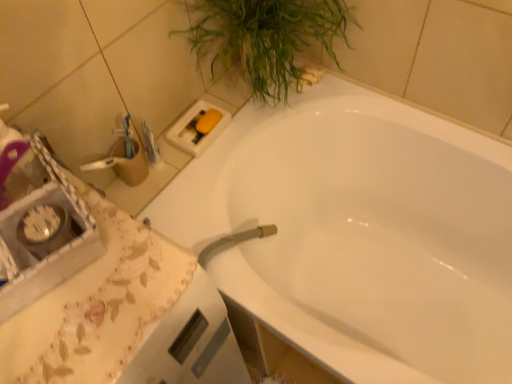
Question: From their relative heights in the image, would you say white glossy bathtub at upper center is taller or shorter than green leafy plant at upper right?

Choices:
 (A) short
 (B) tall

Answer: (B)

Question: Would you say white glossy bathtub at upper center is inside or outside green leafy plant at upper right?

Choices:
 (A) inside
 (B) outside

Answer: (B)

Question: Based on their relative distances, which object is farther from the white glossy bathtub at upper center?

Choices:
 (A) white fabric at lower left
 (B) green leafy plant at upper right

Answer: (A)

Question: Considering the real-world distances, which object is closest to the white glossy bathtub at upper center?

Choices:
 (A) green leafy plant at upper right
 (B) white fabric at lower left

Answer: (A)